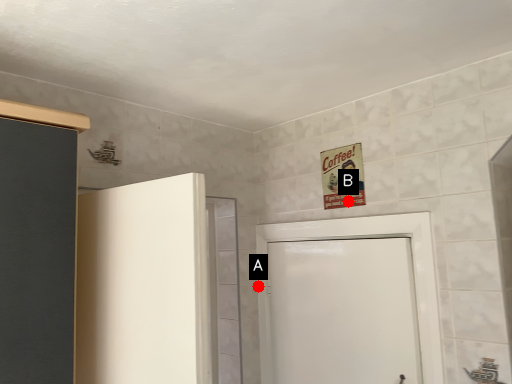
Question: Two points are circled on the image, labeled by A and B beside each circle. Which point is farther to the camera?

Choices:
 (A) A is further
 (B) B is further

Answer: (A)